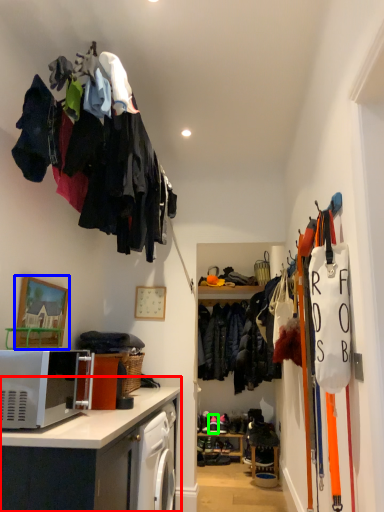
Question: Which is nearer to the cabinetry (highlighted by a red box)? picture frame (highlighted by a blue box) or footwear (highlighted by a green box).

Choices:
 (A) picture frame
 (B) footwear

Answer: (A)